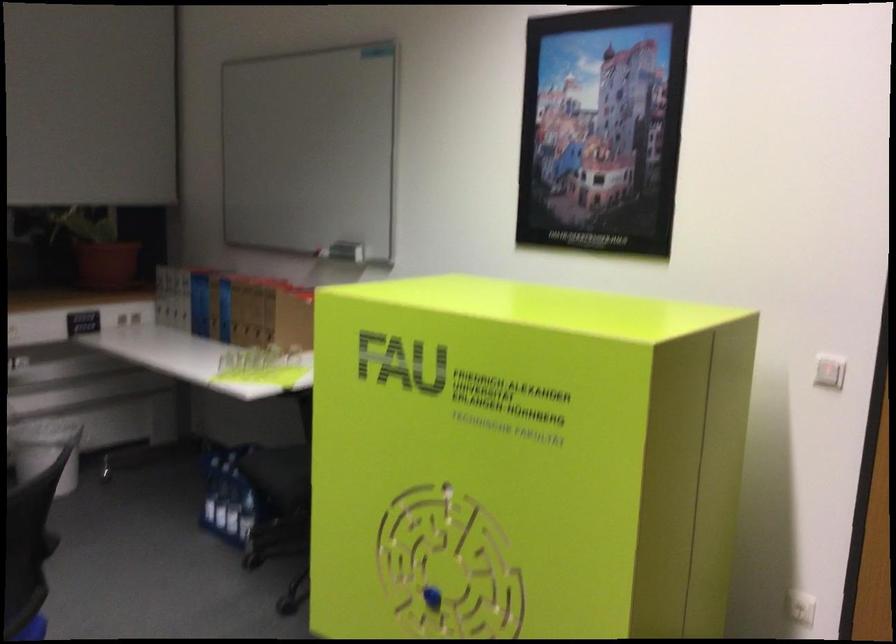
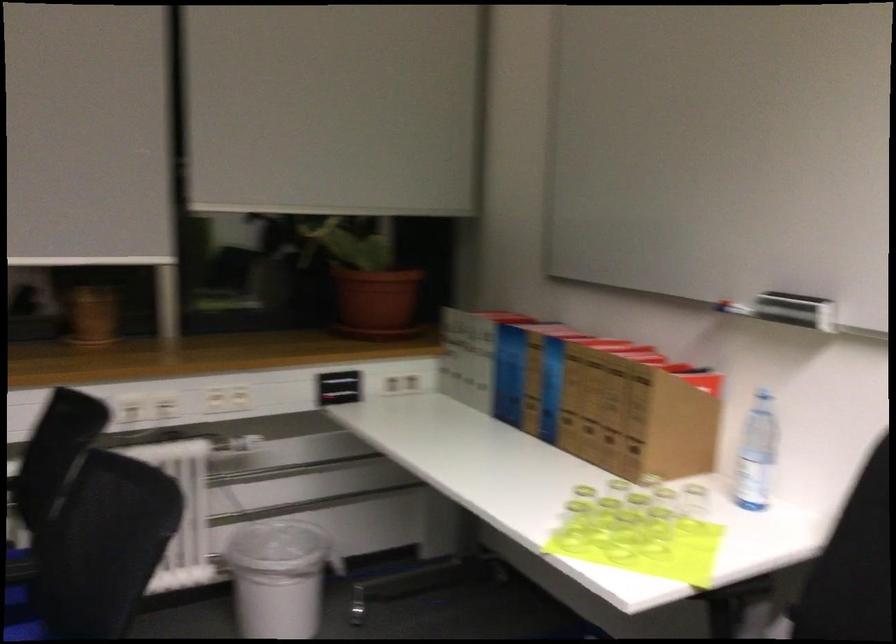
In the second image, find the point that corresponds to (277,372) in the first image.

(655, 534)